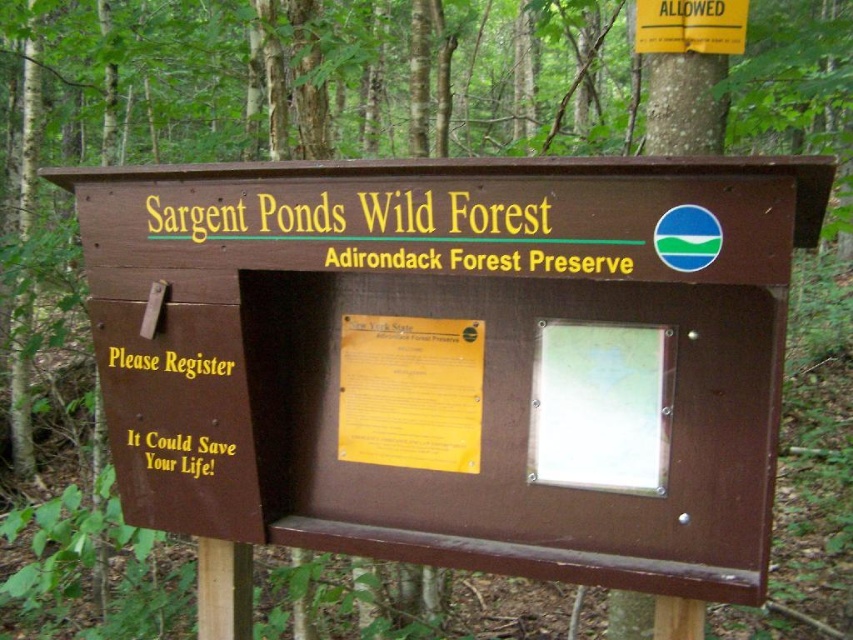
You are standing in front of the wooden box at Sargent Ponds Wild Forest. Where exactly is the brown wood sign at center located in terms of its 2D coordinates?

The brown wood sign at center is located at the 2D coordinates point (454, 337).

What is the spatial relationship between the transparent plastic map at center and the yellow metallic text at lower left on the registration box?

The transparent plastic map at center is to the right of the yellow metallic text at lower left.